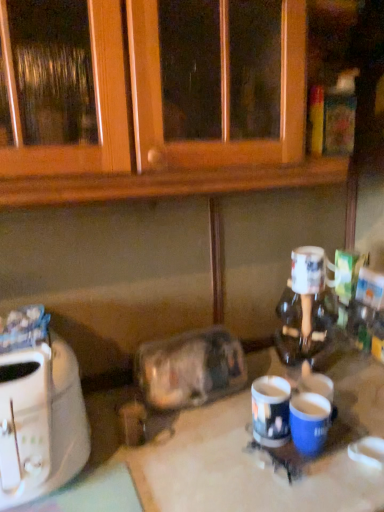
The height and width of the screenshot is (512, 384). I want to click on vacant location behind blue glossy mug at center, positioned as the second coffee cup in bottom-to-top order, so click(236, 400).